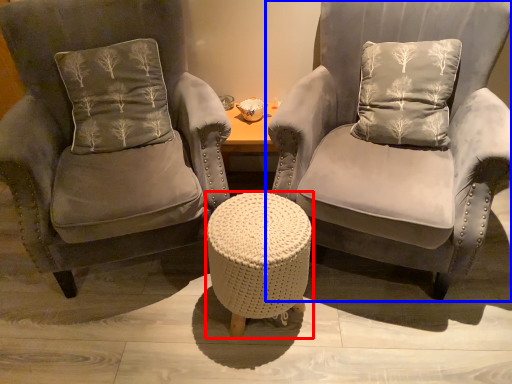
Question: Which point is further to the camera, table (highlighted by a red box) or chair (highlighted by a blue box)?

Choices:
 (A) table
 (B) chair

Answer: (A)